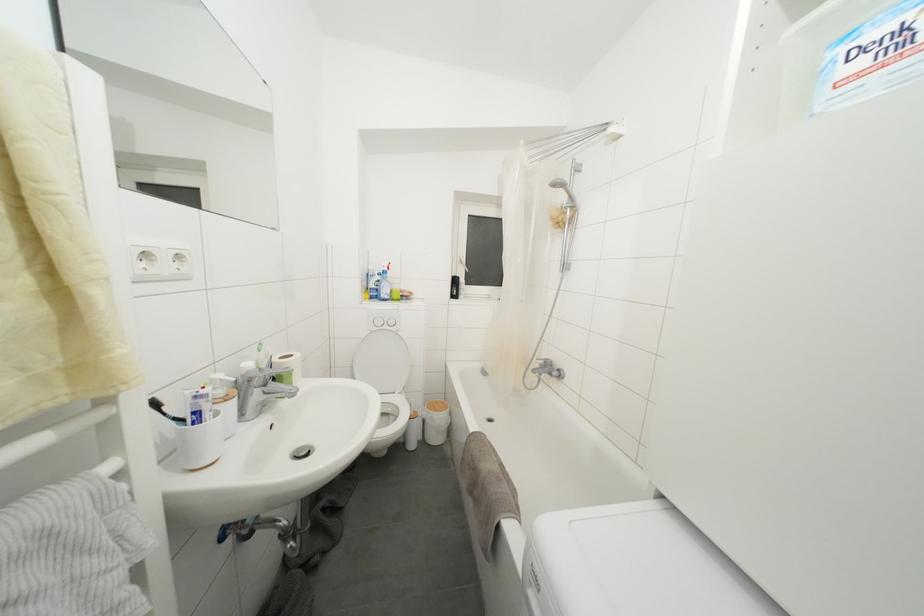
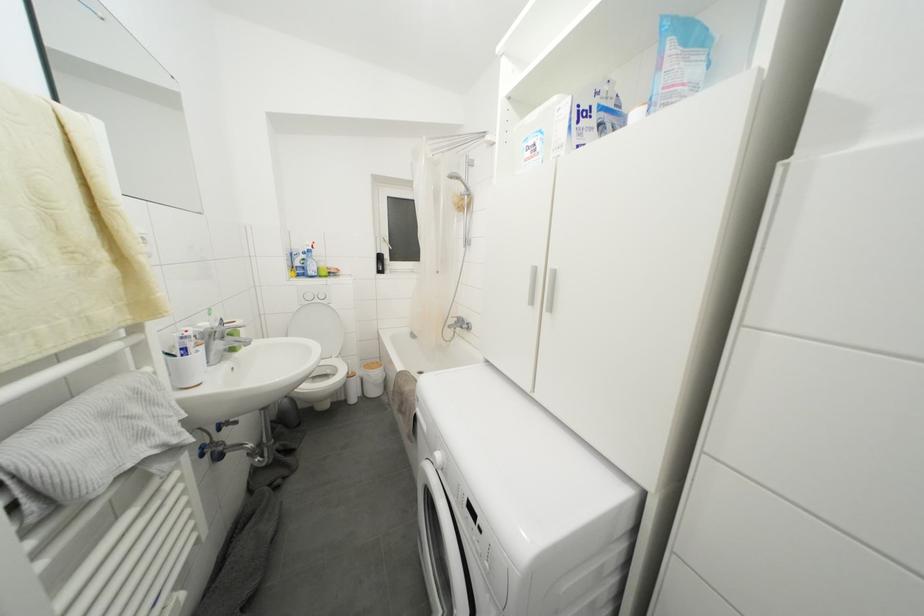
Where in the second image is the point corresponding to (x=566, y=190) from the first image?

(463, 182)